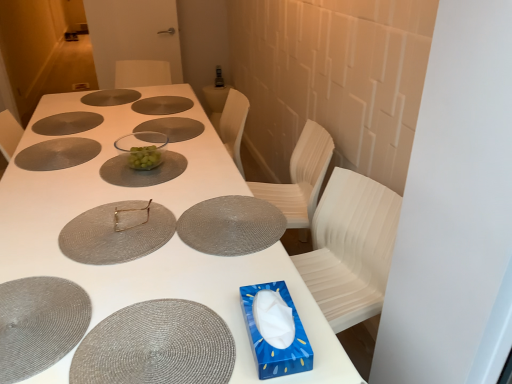
In order to click on vacant space in between matte gray placemat at center, placed as the seventh glass plate when sorted from back to front, and transparent glass bowl at center, which is the fourth glass plate from front to back in this screenshot , I will do `click(186, 179)`.